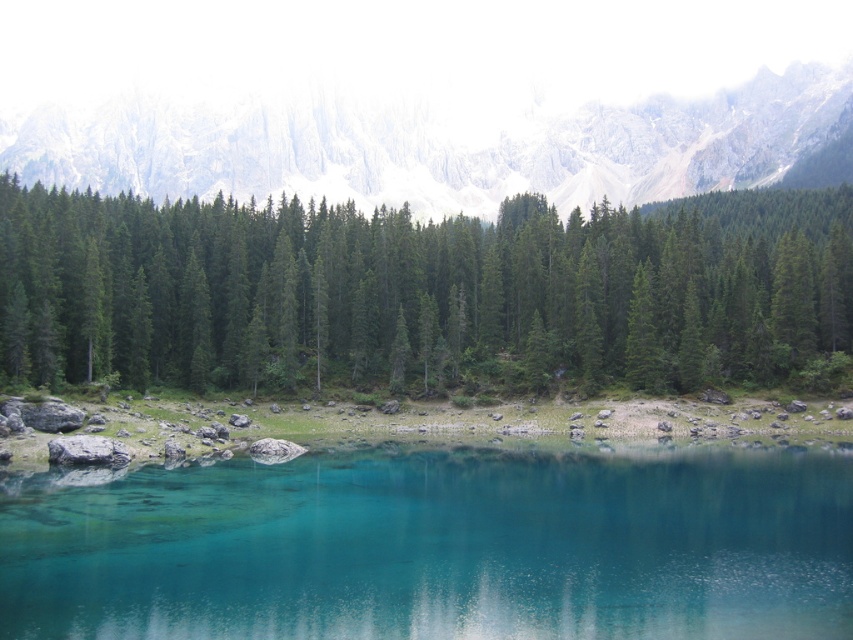
Which of these two, green matte pine forest at center or transparent glass water at center, stands shorter?

transparent glass water at center

Is point (343, 294) less distant than point (733, 545)?

No.

This screenshot has height=640, width=853. I want to click on green matte pine forest at center, so click(x=425, y=292).

How much distance is there between transparent glass water at center and white rocky mountain at upper center?

The distance of transparent glass water at center from white rocky mountain at upper center is 216.06 meters.

Describe the element at coordinates (436, 547) in the screenshot. The height and width of the screenshot is (640, 853). I see `transparent glass water at center` at that location.

I want to click on transparent glass water at center, so click(x=436, y=547).

Can you confirm if green matte pine forest at center is positioned to the right of white rocky mountain at upper center?

Yes, green matte pine forest at center is to the right of white rocky mountain at upper center.

Does green matte pine forest at center appear over white rocky mountain at upper center?

No, green matte pine forest at center is not above white rocky mountain at upper center.

Find the location of a particular element. The height and width of the screenshot is (640, 853). green matte pine forest at center is located at coordinates (425, 292).

This screenshot has width=853, height=640. I want to click on green matte pine forest at center, so click(425, 292).